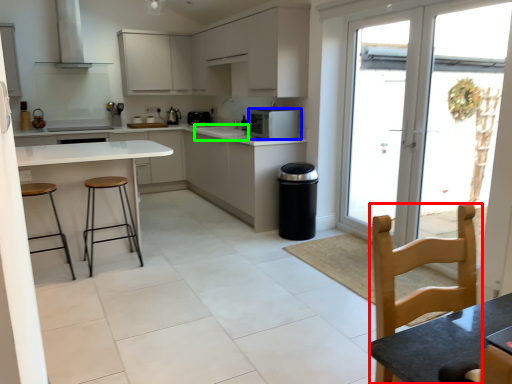
Question: Which object is the closest to the chair (highlighted by a red box)? Choose among these: kitchen appliance (highlighted by a blue box) or sink (highlighted by a green box).

Choices:
 (A) kitchen appliance
 (B) sink

Answer: (A)